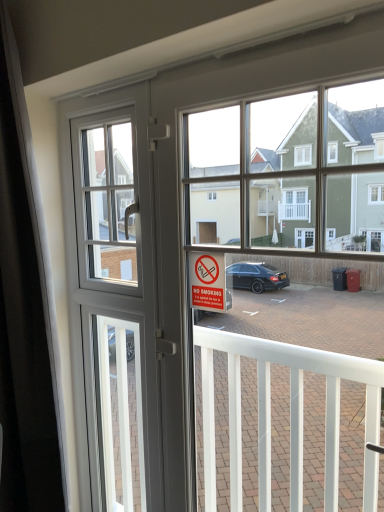
Question: Considering the positions of black matte curtain at left and clear glass screen door at center in the image, is black matte curtain at left taller or shorter than clear glass screen door at center?

Choices:
 (A) short
 (B) tall

Answer: (B)

Question: Is black matte curtain at left in front of or behind clear glass screen door at center in the image?

Choices:
 (A) behind
 (B) front

Answer: (B)

Question: Considering the real-world distances, which object is farthest from the clear glass screen door at center?

Choices:
 (A) no smoking" sign at center
 (B) black matte curtain at left
 (C) white plastic window screen at upper left

Answer: (A)

Question: Which is farther from the white plastic window screen at upper left?

Choices:
 (A) no smoking" sign at center
 (B) clear glass screen door at center
 (C) black matte curtain at left

Answer: (B)